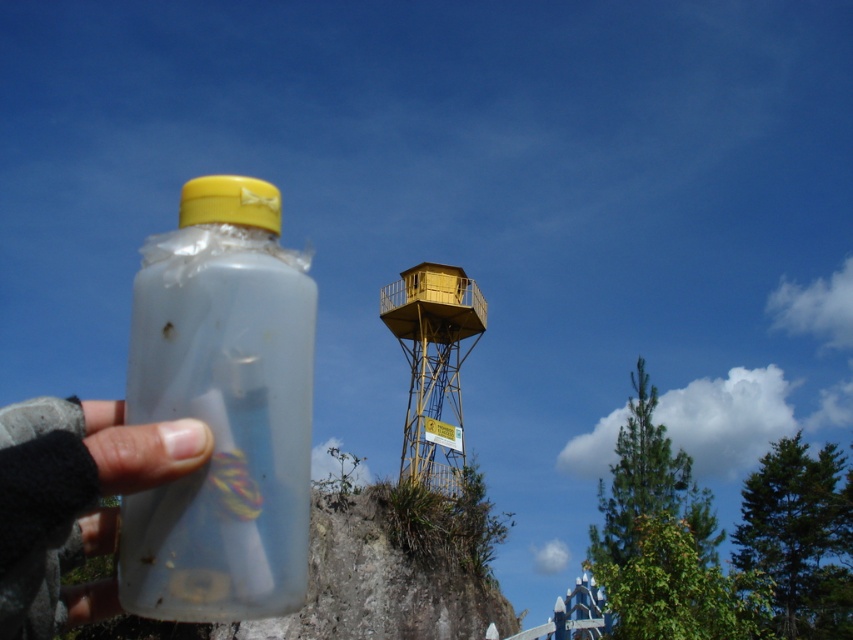
Does transparent plastic bottle at center appear over transparent plastic bottle at lower left?

Indeed, transparent plastic bottle at center is positioned over transparent plastic bottle at lower left.

Does transparent plastic bottle at center appear on the right side of transparent plastic bottle at lower left?

Incorrect, transparent plastic bottle at center is not on the right side of transparent plastic bottle at lower left.

Which is behind, point (282, 540) or point (62, 444)?

The point (282, 540) is behind.

Where is `transparent plastic bottle at center`? This screenshot has width=853, height=640. transparent plastic bottle at center is located at coordinates (222, 410).

Is point (45, 433) closer to camera compared to point (421, 332)?

Yes, point (45, 433) is closer to viewer.

Image resolution: width=853 pixels, height=640 pixels. What do you see at coordinates (73, 500) in the screenshot?
I see `transparent plastic bottle at lower left` at bounding box center [73, 500].

Locate an element on the screen. transparent plastic bottle at lower left is located at coordinates (73, 500).

Does transparent plastic bottle at center have a greater width compared to yellow matte water tower at center?

Incorrect, transparent plastic bottle at center's width does not surpass yellow matte water tower at center's.

Who is lower down, transparent plastic bottle at center or yellow matte water tower at center?

yellow matte water tower at center

Find the location of `transparent plastic bottle at center`. transparent plastic bottle at center is located at coordinates (222, 410).

This screenshot has width=853, height=640. What are the coordinates of `transparent plastic bottle at center` in the screenshot? It's located at (222, 410).